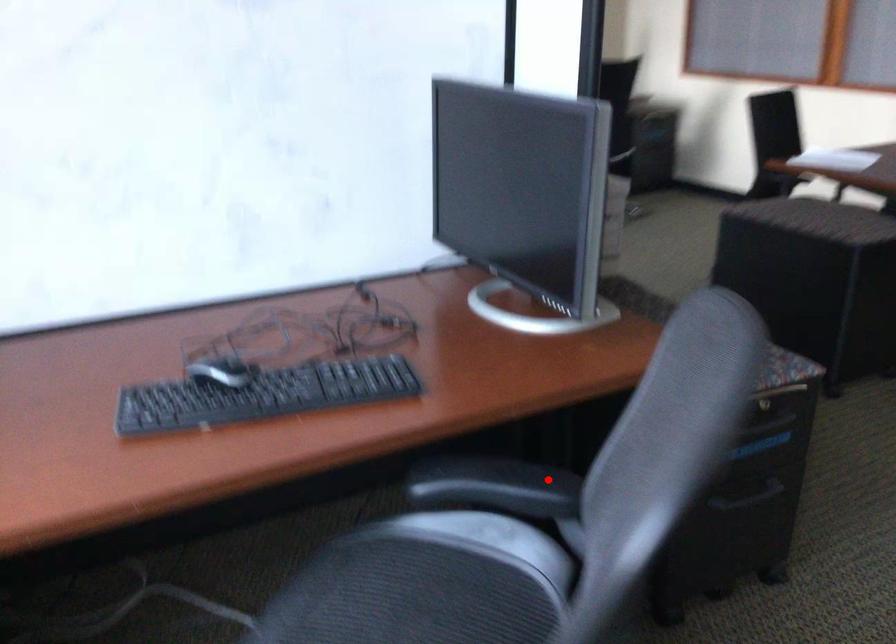
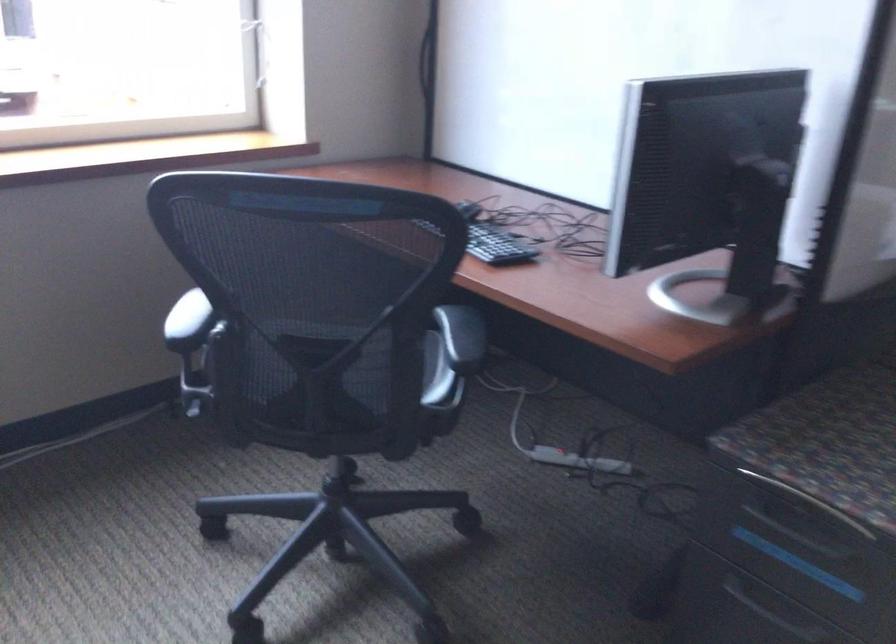
The point at the highlighted location is marked in the first image. Where is the corresponding point in the second image?

(461, 337)